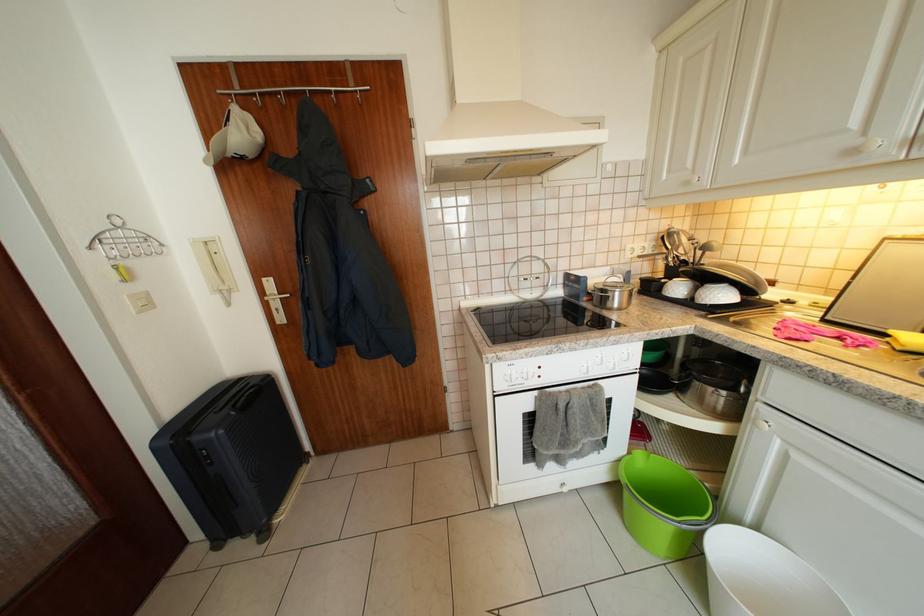
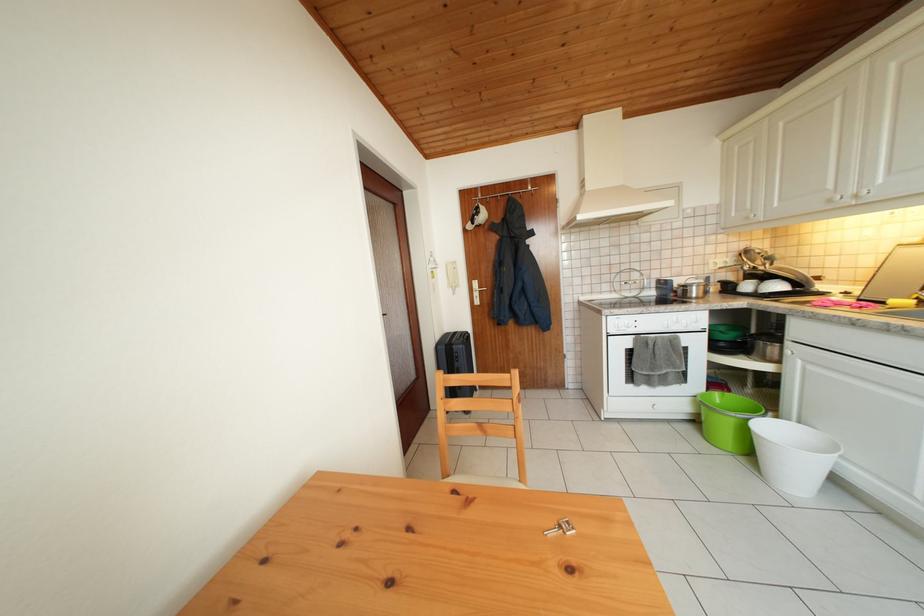
In the second image, find the point that corresponds to [277,288] in the first image.

(483, 288)